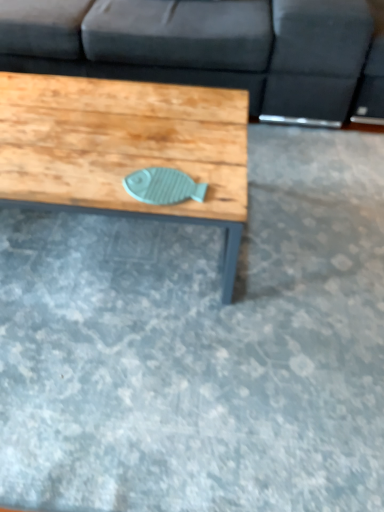
Question: Is dark gray fabric couch at upper center completely or partially inside wooden fish at center?

Choices:
 (A) yes
 (B) no

Answer: (B)

Question: Is wooden fish at center facing towards dark gray fabric couch at upper center?

Choices:
 (A) yes
 (B) no

Answer: (B)

Question: Considering the relative sizes of wooden fish at center and dark gray fabric couch at upper center in the image provided, is wooden fish at center taller than dark gray fabric couch at upper center?

Choices:
 (A) no
 (B) yes

Answer: (A)

Question: Are wooden fish at center and dark gray fabric couch at upper center beside each other?

Choices:
 (A) yes
 (B) no

Answer: (B)

Question: From a real-world perspective, is wooden fish at center below dark gray fabric couch at upper center?

Choices:
 (A) yes
 (B) no

Answer: (A)

Question: Does wooden fish at center appear on the right side of dark gray fabric couch at upper center?

Choices:
 (A) no
 (B) yes

Answer: (A)

Question: Is dark gray fabric couch at upper center further to the viewer compared to wooden fish at center?

Choices:
 (A) yes
 (B) no

Answer: (A)

Question: Is dark gray fabric couch at upper center not near wooden fish at center?

Choices:
 (A) yes
 (B) no

Answer: (B)

Question: From the image's perspective, is dark gray fabric couch at upper center under wooden fish at center?

Choices:
 (A) no
 (B) yes

Answer: (A)

Question: Considering the relative sizes of dark gray fabric couch at upper center and wooden fish at center in the image provided, is dark gray fabric couch at upper center thinner than wooden fish at center?

Choices:
 (A) yes
 (B) no

Answer: (B)

Question: Is dark gray fabric couch at upper center facing away from wooden fish at center?

Choices:
 (A) yes
 (B) no

Answer: (B)

Question: Considering the relative positions of dark gray fabric couch at upper center and wooden fish at center in the image provided, is dark gray fabric couch at upper center in front of wooden fish at center?

Choices:
 (A) yes
 (B) no

Answer: (B)

Question: From a real-world perspective, is wooden fish at center positioned above or below dark gray fabric couch at upper center?

Choices:
 (A) above
 (B) below

Answer: (B)